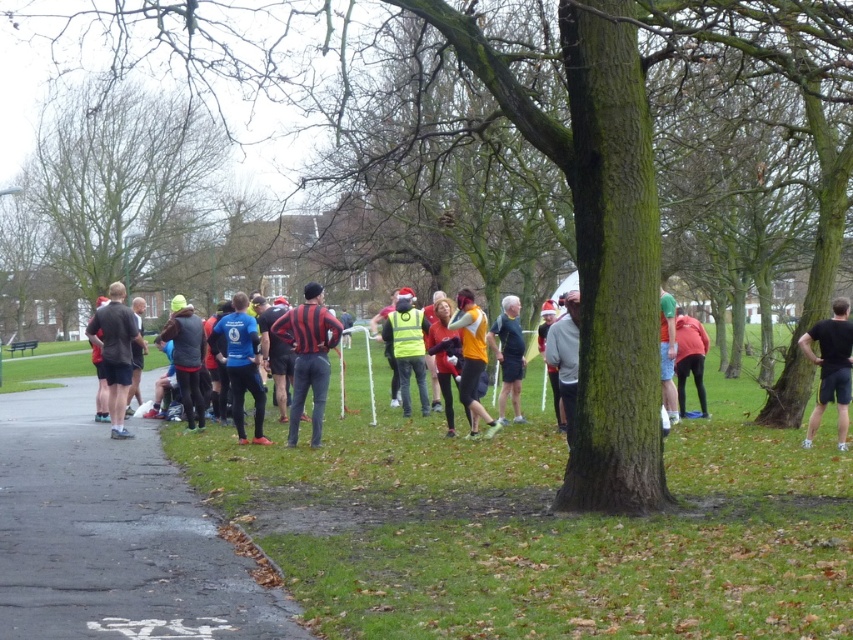
You are a runner participating in a race in the park. You need to find the high visibility yellow vest at center to collect a race kit. According to the map coordinates provided, where exactly should you look for it?

The high visibility yellow vest at center is located at point (407, 348) on the map.

Looking at this image, you are a photographer trying to capture a closeup of the black matte shirt at right. Based on the scene description, where should you position your camera to get the best shot?

The black matte shirt at right is located at point (830, 368), so you should position your camera near that coordinate to capture a closeup.

You are a participant in the park run and want to place a marker between the two points, point (389, 352) and point (490, 346). Which point is closer to you so you can place the marker in front of it?

Point (389, 352) is closer to you than point (490, 346), so you should place the marker in front of point (389, 352).